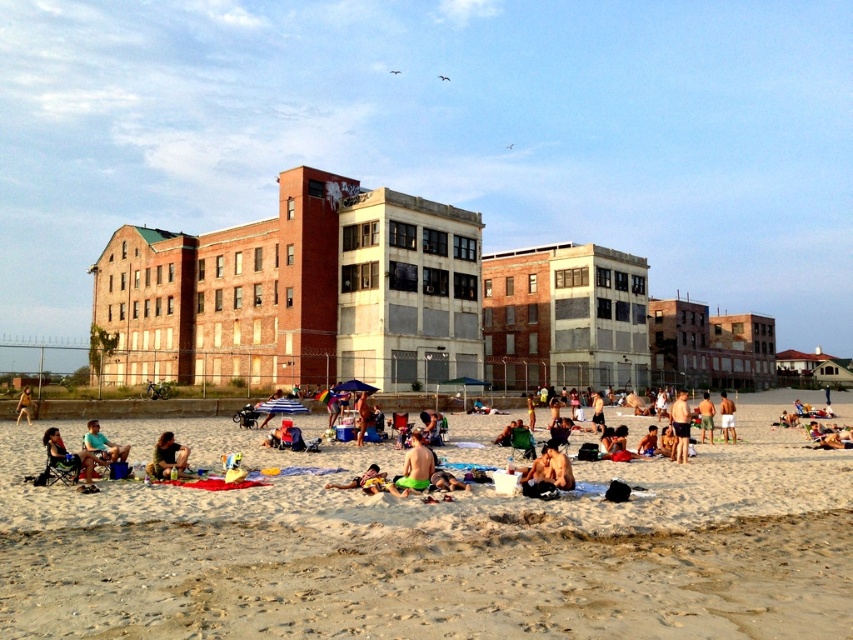
You are standing at the center of the beach scene. You need to locate the matte black chair at lower left. Which direction should you look to find it?

The matte black chair at lower left is located at point 0.713 on the x axis and 0.082 on the y axis, so you should look to the lower left direction to find it.

You are a photographer trying to capture the two pairs of green shorts at the center of the beach scene. According to the image, which direction should you move your camera to focus on the green matte shorts at center first and then the green fabric shorts at center?

Since the green matte shorts at center are to the left of the green fabric shorts at center, you should first aim your camera to the left to focus on the green matte shorts at center and then pan slightly to the right to capture the green fabric shorts at center.